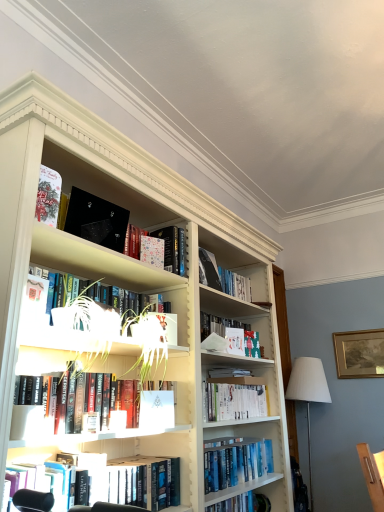
Question: In which direction should I rotate to look at hardcover book at center, which is counted as the 3th book, starting from the top?

Choices:
 (A) right
 (B) left

Answer: (A)

Question: From the image's perspective, is hardcover book at center, which appears as the fifth book when viewed from the top, located above hardcover book at center, the first book from the bottom?

Choices:
 (A) yes
 (B) no

Answer: (A)

Question: Considering the relative sizes of hardcover book at center, which appears as the fifth book when viewed from the top, and hardcover book at center, the seventh book from the top, in the image provided, is hardcover book at center, which appears as the fifth book when viewed from the top, smaller than hardcover book at center, the seventh book from the top,?

Choices:
 (A) yes
 (B) no

Answer: (B)

Question: From a real-world perspective, is hardcover book at center, which appears as the fifth book when viewed from the top, beneath hardcover book at center, the first book from the bottom?

Choices:
 (A) no
 (B) yes

Answer: (A)

Question: Is hardcover book at center, marked as the 3th book in a bottom-to-top arrangement, turned away from hardcover book at center, the seventh book from the top?

Choices:
 (A) no
 (B) yes

Answer: (A)

Question: Considering the relative positions of hardcover book at center, marked as the 3th book in a bottom-to-top arrangement, and hardcover book at center, the first book from the bottom, in the image provided, is hardcover book at center, marked as the 3th book in a bottom-to-top arrangement, to the left of hardcover book at center, the first book from the bottom, from the viewer's perspective?

Choices:
 (A) no
 (B) yes

Answer: (B)

Question: Is hardcover book at center, marked as the 3th book in a bottom-to-top arrangement, positioned far away from hardcover book at center, the first book from the bottom?

Choices:
 (A) no
 (B) yes

Answer: (A)

Question: From a real-world perspective, is gold-framed picture at upper right physically above matte red book at upper left, acting as the 7th book starting from the bottom?

Choices:
 (A) yes
 (B) no

Answer: (B)

Question: Is gold-framed picture at upper right taller than matte red book at upper left, which is counted as the first book, starting from the top?

Choices:
 (A) no
 (B) yes

Answer: (B)

Question: Would you say gold-framed picture at upper right contains matte red book at upper left, which is counted as the first book, starting from the top?

Choices:
 (A) yes
 (B) no

Answer: (B)

Question: Does gold-framed picture at upper right appear on the right side of matte red book at upper left, acting as the 7th book starting from the bottom?

Choices:
 (A) no
 (B) yes

Answer: (B)

Question: Does gold-framed picture at upper right come in front of matte red book at upper left, acting as the 7th book starting from the bottom?

Choices:
 (A) no
 (B) yes

Answer: (A)

Question: From the image's perspective, is gold-framed picture at upper right below matte red book at upper left, acting as the 7th book starting from the bottom?

Choices:
 (A) yes
 (B) no

Answer: (A)

Question: Does green matte plant pot at upper left have a greater width compared to white fabric lampshade at right?

Choices:
 (A) yes
 (B) no

Answer: (B)